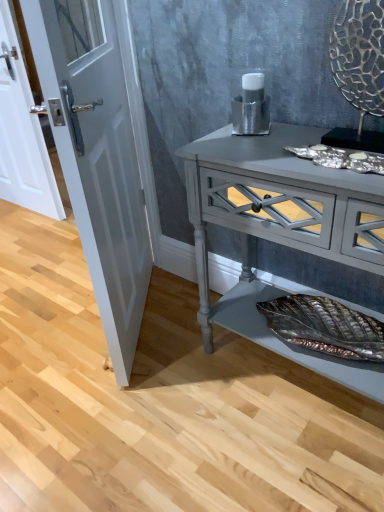
Where is `empty space that is ontop of matte gray console table at center (from a real-world perspective)`? Image resolution: width=384 pixels, height=512 pixels. empty space that is ontop of matte gray console table at center (from a real-world perspective) is located at coordinates (283, 149).